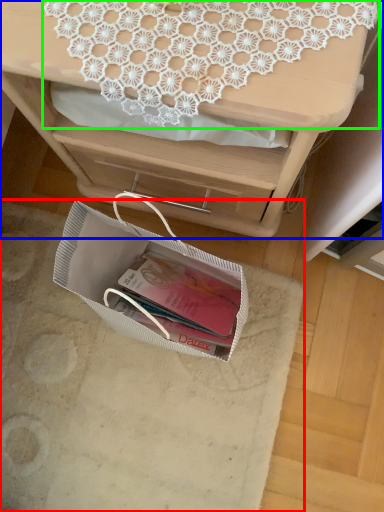
Question: Which object is the farthest from place mat (highlighted by a red box)? Choose among these: desk (highlighted by a blue box) or lace (highlighted by a green box).

Choices:
 (A) desk
 (B) lace

Answer: (B)